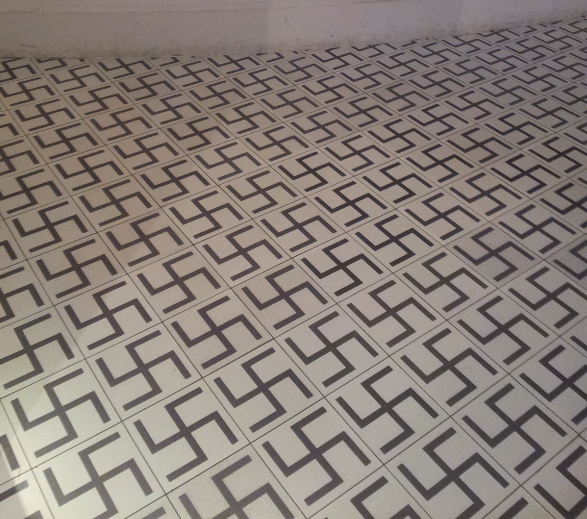
You are a GUI agent. You are given a task and a screenshot of the screen. Output one action in this format:
    pyautogui.click(x=<x>, y=<y>)
    Task: Click on the tile
    The image size is (587, 519).
    Given the screenshot: What is the action you would take?
    (x=544, y=373)